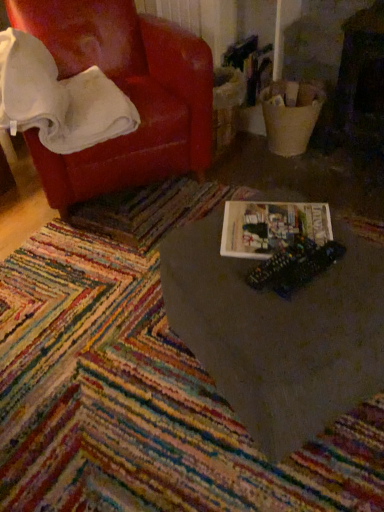
Locate an element on the screen. free space in front of metallic plastic toy at center is located at coordinates (299, 316).